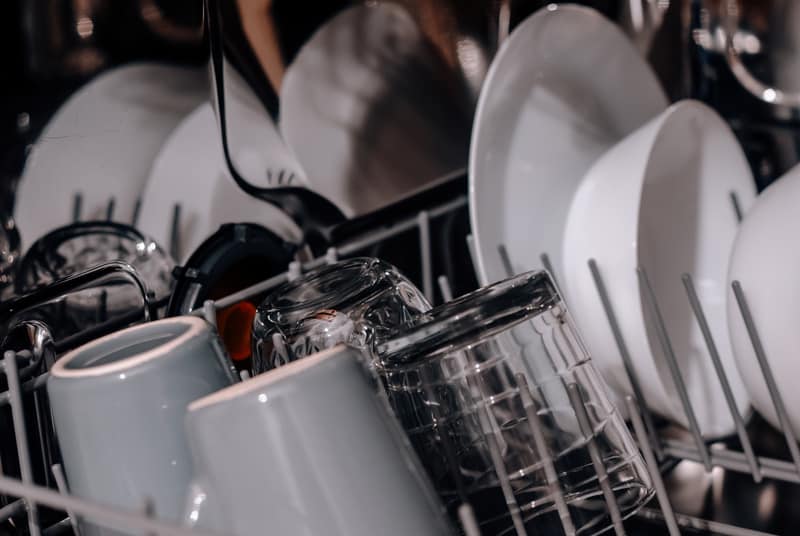
Identify the location of plates. Image resolution: width=800 pixels, height=536 pixels. (506, 155), (394, 129), (226, 176), (140, 162).